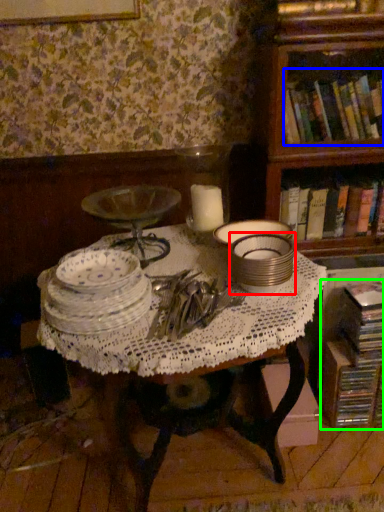
Question: Which is farther away from tableware (highlighted by a red box)? book (highlighted by a blue box) or book (highlighted by a green box)?

Choices:
 (A) book
 (B) book

Answer: (A)